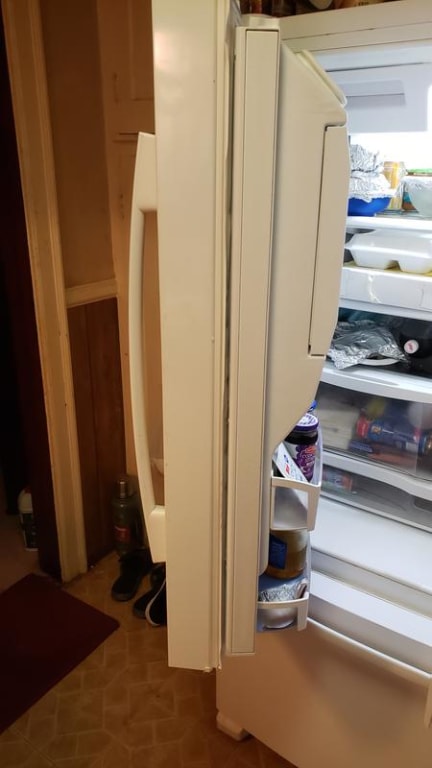
Image resolution: width=432 pixels, height=768 pixels. I want to click on door, so click(x=125, y=88).